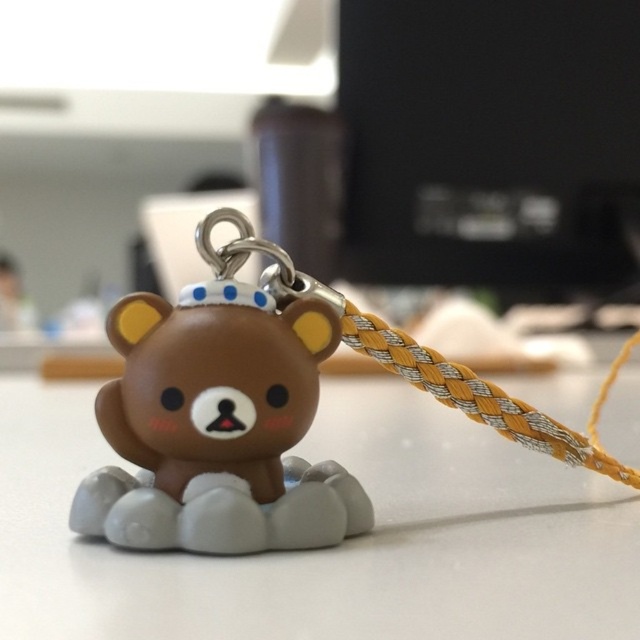
Can you confirm if white matte table at center is positioned to the right of matte brown plush bear at center?

Incorrect, white matte table at center is not on the right side of matte brown plush bear at center.

Where is `white matte table at center`? This screenshot has height=640, width=640. white matte table at center is located at coordinates (336, 547).